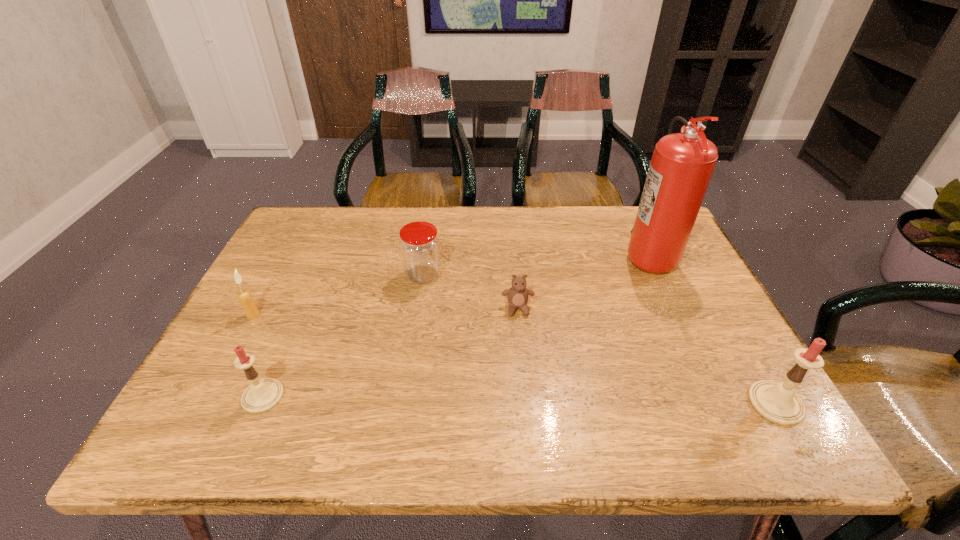
Identify the location of free space that satisfies the following two spatial constraints: 1. on the instruction side of the tallest object; 2. on the front side of the jar. (658, 275).

You are a GUI agent. You are given a task and a screenshot of the screen. Output one action in this format:
    pyautogui.click(x=<x>, y=<y>)
    Task: Click on the free space in the image that satisfies the following two spatial constraints: 1. on the front-facing side of the shortest object; 2. on the left side of the fifth shortest object
    The width and height of the screenshot is (960, 540).
    Given the screenshot: What is the action you would take?
    pyautogui.click(x=526, y=403)

In order to click on free spot that satisfies the following two spatial constraints: 1. on the front side of the leftmost object; 2. on the right side of the tallest candle in this screenshot , I will do `click(205, 403)`.

I want to click on free location that satisfies the following two spatial constraints: 1. on the instruction side of the tallest candle; 2. on the right side of the fire extinguisher, so (717, 403).